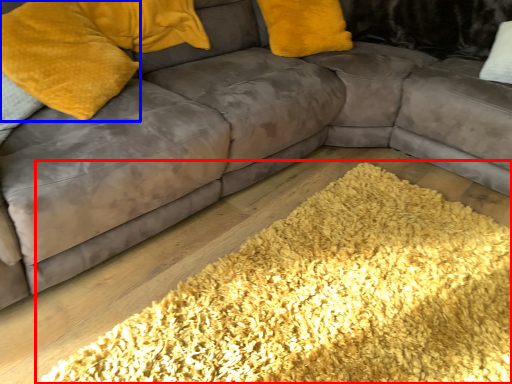
Question: Which object is closer to the camera taking this photo, mat (highlighted by a red box) or pillow (highlighted by a blue box)?

Choices:
 (A) mat
 (B) pillow

Answer: (A)